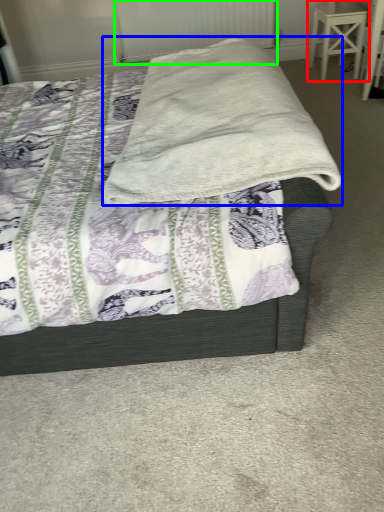
Question: Based on their relative distances, which object is farther from stool (highlighted by a red box)? Choose from blanket (highlighted by a blue box) and radiator (highlighted by a green box).

Choices:
 (A) blanket
 (B) radiator

Answer: (A)